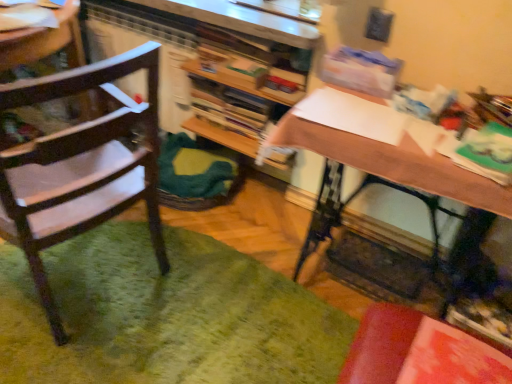
Question: Is wooden desk at center to the left of wooden chair at left from the viewer's perspective?

Choices:
 (A) no
 (B) yes

Answer: (A)

Question: Does wooden desk at center appear on the right side of wooden chair at left?

Choices:
 (A) yes
 (B) no

Answer: (A)

Question: Is wooden desk at center taller than wooden chair at left?

Choices:
 (A) no
 (B) yes

Answer: (A)

Question: From a real-world perspective, is wooden desk at center positioned under wooden chair at left based on gravity?

Choices:
 (A) no
 (B) yes

Answer: (B)

Question: Is wooden chair at left at the back of wooden desk at center?

Choices:
 (A) yes
 (B) no

Answer: (B)

Question: Does wooden desk at center come behind wooden chair at left?

Choices:
 (A) yes
 (B) no

Answer: (A)

Question: Considering the relative sizes of wooden chair at left and wooden bookshelf at center in the image provided, is wooden chair at left bigger than wooden bookshelf at center?

Choices:
 (A) no
 (B) yes

Answer: (B)

Question: From the image's perspective, is wooden chair at left on top of wooden bookshelf at center?

Choices:
 (A) no
 (B) yes

Answer: (A)

Question: Is wooden chair at left taller than wooden bookshelf at center?

Choices:
 (A) yes
 (B) no

Answer: (A)

Question: Could wooden bookshelf at center be considered to be inside wooden chair at left?

Choices:
 (A) no
 (B) yes

Answer: (A)

Question: Considering the relative sizes of wooden chair at left and wooden bookshelf at center in the image provided, is wooden chair at left wider than wooden bookshelf at center?

Choices:
 (A) no
 (B) yes

Answer: (B)

Question: Does wooden chair at left touch wooden bookshelf at center?

Choices:
 (A) yes
 (B) no

Answer: (B)

Question: Can you confirm if green fuzzy mat at lower left is thinner than wooden desk at center?

Choices:
 (A) no
 (B) yes

Answer: (A)